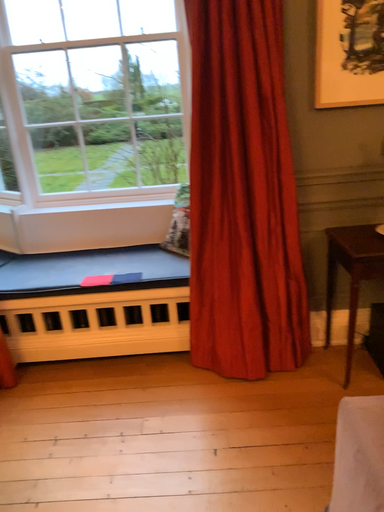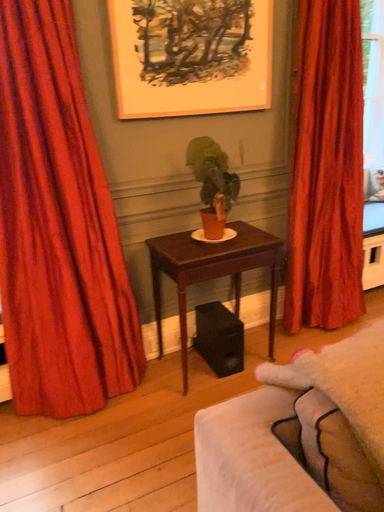
Question: How did the camera likely rotate when shooting the video?

Choices:
 (A) rotated left
 (B) rotated right

Answer: (B)